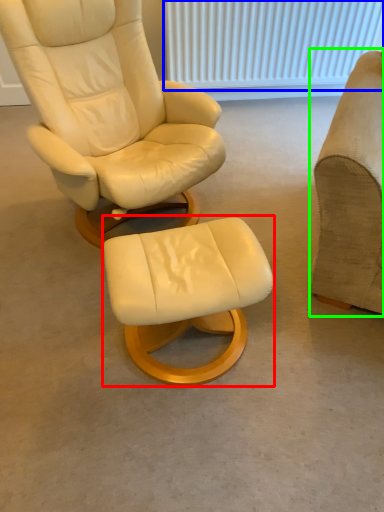
Question: Which is farther away from stool (highlighted by a red box)? radiator (highlighted by a blue box) or chair (highlighted by a green box)?

Choices:
 (A) radiator
 (B) chair

Answer: (A)